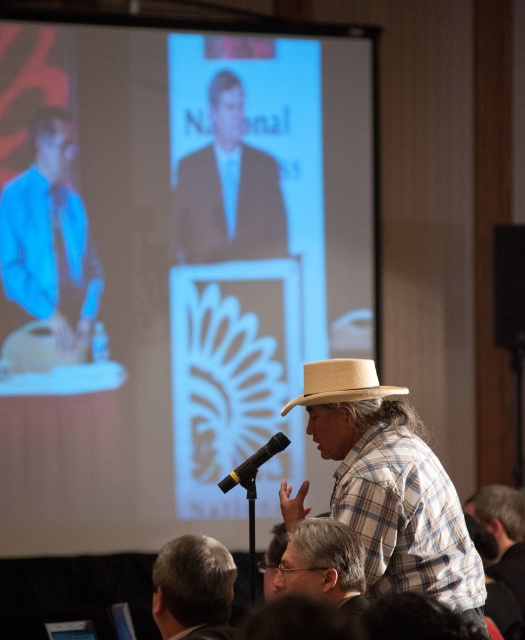
Can you confirm if white matte projection screen at upper center is positioned to the left of black matte microphone at center?

Indeed, white matte projection screen at upper center is positioned on the left side of black matte microphone at center.

Can you confirm if white matte projection screen at upper center is positioned below black matte microphone at center?

No.

Who is more distant from viewer, (142, 424) or (280, 438)?

Point (142, 424)

Image resolution: width=525 pixels, height=640 pixels. In order to click on white matte projection screen at upper center in this screenshot , I will do `click(172, 266)`.

Who is higher up, plaid shirt at center or woven straw hat at center?

woven straw hat at center is above.

Which of these two, plaid shirt at center or woven straw hat at center, stands taller?

plaid shirt at center

This screenshot has height=640, width=525. What do you see at coordinates (500, 554) in the screenshot? I see `plaid shirt at center` at bounding box center [500, 554].

At what (x,y) coordinates should I click in order to perform the action: click on plaid shirt at center. Please return your answer as a coordinate pair (x, y). Looking at the image, I should click on (500, 554).

Can you confirm if gray hair at upper center is smaller than plaid shirt at center?

Indeed, gray hair at upper center has a smaller size compared to plaid shirt at center.

Is point (160, 577) in front of point (494, 579)?

That is True.

Describe the element at coordinates (193, 588) in the screenshot. I see `gray hair at upper center` at that location.

You are a GUI agent. You are given a task and a screenshot of the screen. Output one action in this format:
    pyautogui.click(x=<x>, y=<y>)
    Task: Click on the gray hair at upper center
    
    Given the screenshot: What is the action you would take?
    pyautogui.click(x=193, y=588)